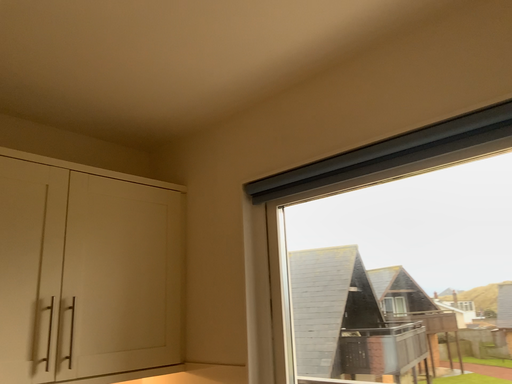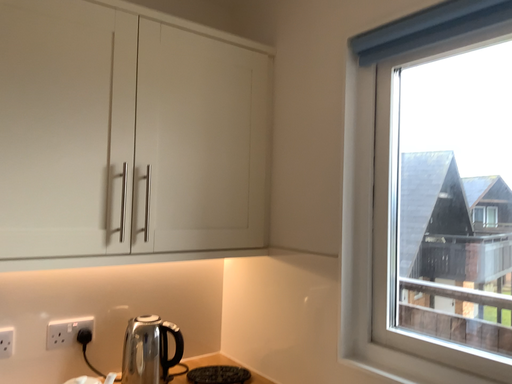
Question: Which way did the camera rotate in the video?

Choices:
 (A) rotated upward
 (B) rotated downward

Answer: (B)